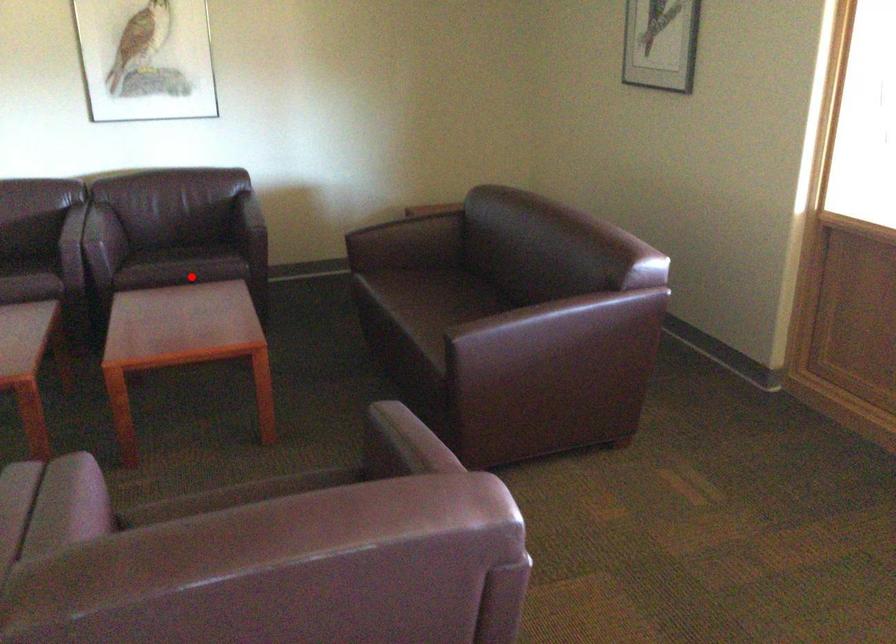
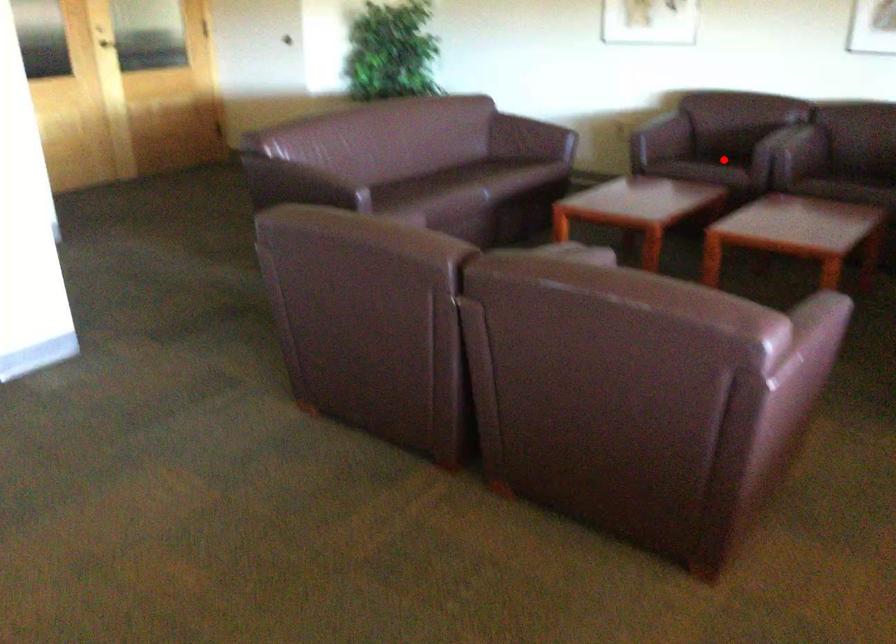
I am providing you with two images of the same scene from different viewpoints. A red point is marked on the first image and another point is marked on the second image. Is the red point in image1 aligned with the point shown in image2?

No